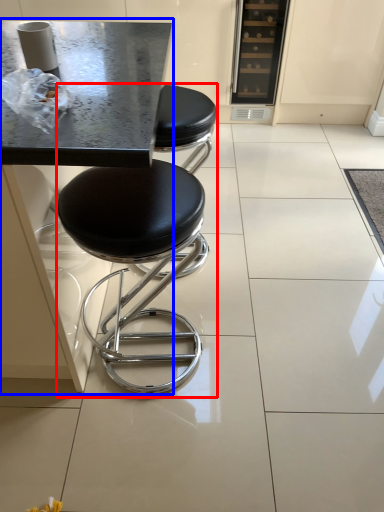
Question: Which object is further to the camera taking this photo, stool (highlighted by a red box) or round table (highlighted by a blue box)?

Choices:
 (A) stool
 (B) round table

Answer: (A)